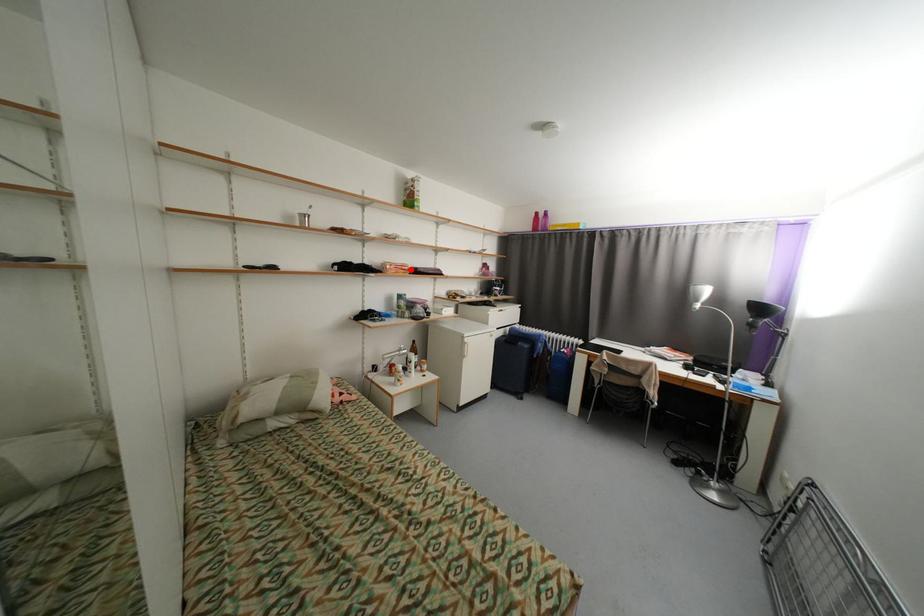
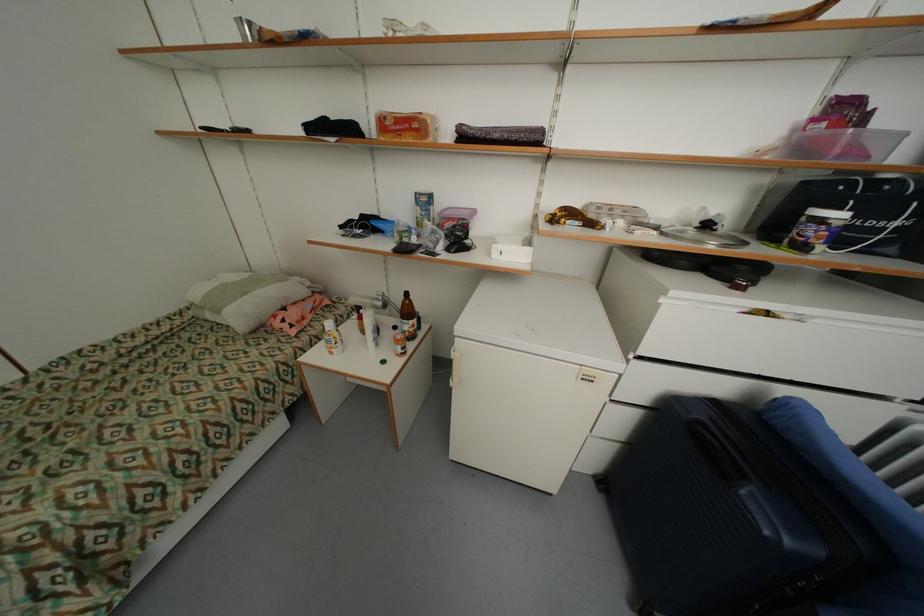
In the second image, find the point that corresponds to the highlighted location in the first image.

(421, 126)